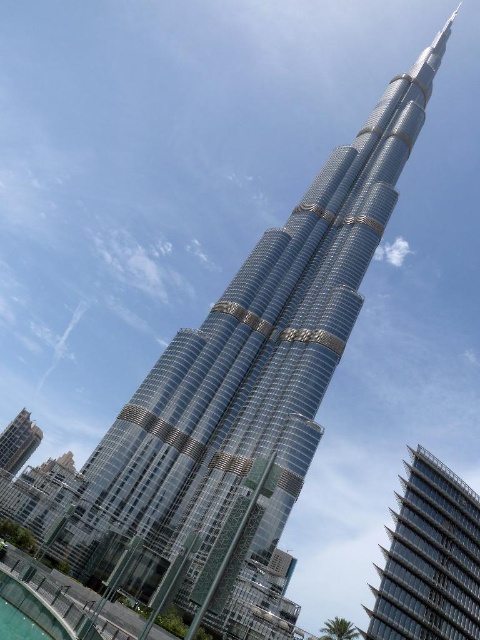
Which is more to the right, glassy metallic skyscraper at right or glassy metallic building at lower left?

Positioned to the right is glassy metallic skyscraper at right.

Can you confirm if glassy metallic skyscraper at right is shorter than glassy metallic building at lower left?

A: Yes, glassy metallic skyscraper at right is shorter than glassy metallic building at lower left.

Describe the element at coordinates (429, 557) in the screenshot. The image size is (480, 640). I see `glassy metallic skyscraper at right` at that location.

The image size is (480, 640). Identify the location of glassy metallic skyscraper at right. (429, 557).

Is point (21, 598) positioned in front of point (10, 460)?

Yes, point (21, 598) is in front of point (10, 460).

Which of these two, clear glass pool at lower left or glassy metallic building at lower left, stands taller?

glassy metallic building at lower left

Is point (38, 620) positioned after point (25, 412)?

No.

Find the location of a particular element. This screenshot has width=480, height=640. clear glass pool at lower left is located at coordinates (33, 605).

Between glassy metallic skyscraper at right and clear glass pool at lower left, which one is positioned higher?

clear glass pool at lower left is above.

Which is more to the right, glassy metallic skyscraper at right or clear glass pool at lower left?

glassy metallic skyscraper at right is more to the right.

The height and width of the screenshot is (640, 480). I want to click on glassy metallic skyscraper at right, so click(429, 557).

I want to click on glassy metallic skyscraper at right, so coord(429,557).